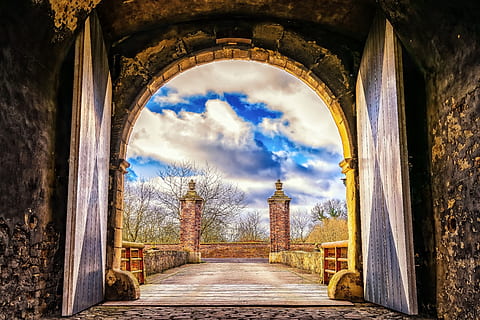
Locate an element on the screen. the right door is located at coordinates (95, 262).